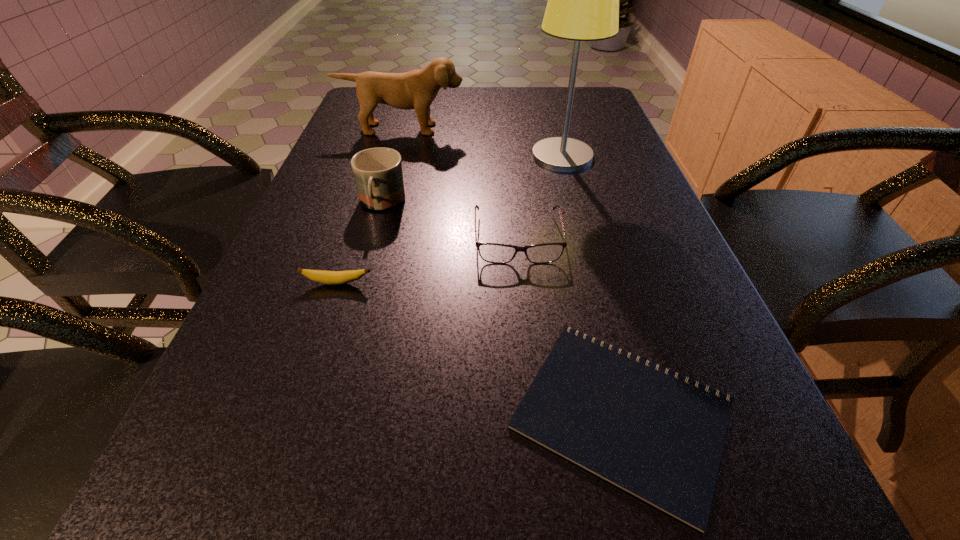
The width and height of the screenshot is (960, 540). I want to click on the tallest object, so click(x=583, y=0).

Find the location of a particular element. Image resolution: width=960 pixels, height=540 pixels. the fifth nearest object is located at coordinates (583, 0).

Where is `the second tallest object`? This screenshot has width=960, height=540. the second tallest object is located at coordinates click(x=417, y=89).

This screenshot has height=540, width=960. In order to click on the farthest object in this screenshot , I will do `click(417, 89)`.

Identify the location of the third tallest object. Image resolution: width=960 pixels, height=540 pixels. (378, 172).

Identify the location of the third shortest object. 495,253.

This screenshot has height=540, width=960. I want to click on the second nearest object, so click(x=327, y=277).

The height and width of the screenshot is (540, 960). What are the coordinates of `the second shortest object` in the screenshot? It's located at (327, 277).

This screenshot has width=960, height=540. Find the location of `notepad`. notepad is located at coordinates (660, 439).

This screenshot has width=960, height=540. Find the location of `the shortest object`. the shortest object is located at coordinates coord(660,439).